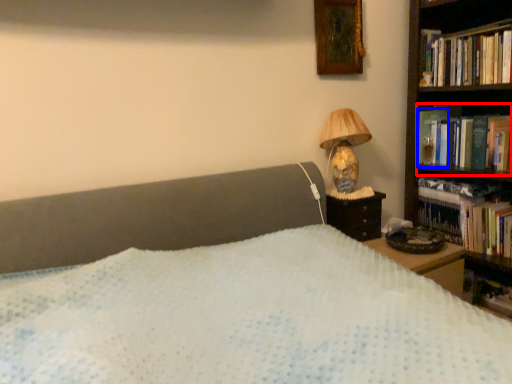
Question: Which object is closer to the camera taking this photo, book (highlighted by a red box) or paperback book (highlighted by a blue box)?

Choices:
 (A) book
 (B) paperback book

Answer: (A)